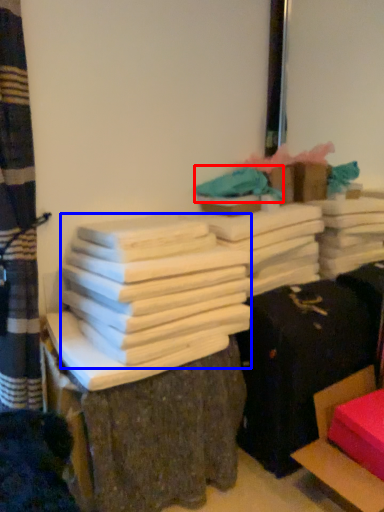
Question: Among these objects, which one is farthest to the camera, fabric (highlighted by a red box) or bundle (highlighted by a blue box)?

Choices:
 (A) fabric
 (B) bundle

Answer: (A)